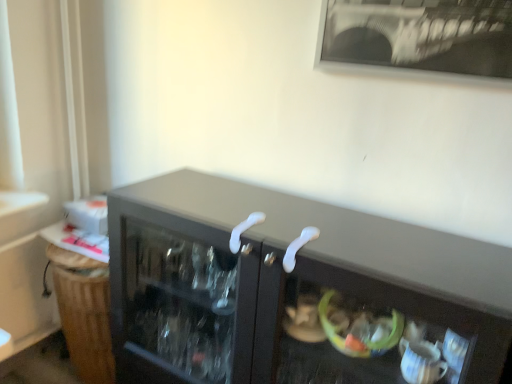
Question: Can you see white plastic door handle at center, which is counted as the 2th door handle, starting from the right, touching white plastic door handle at center, which is the 1th door handle in right-to-left order?

Choices:
 (A) no
 (B) yes

Answer: (A)

Question: From a real-world perspective, is white plastic door handle at center, the 1th door handle in the left-to-right sequence, below white plastic door handle at center, which is the 1th door handle in right-to-left order?

Choices:
 (A) yes
 (B) no

Answer: (B)

Question: Is white plastic door handle at center, which is the 1th door handle in right-to-left order, surrounded by white plastic door handle at center, the 1th door handle in the left-to-right sequence?

Choices:
 (A) no
 (B) yes

Answer: (A)

Question: Considering the relative positions of white plastic door handle at center, the 1th door handle in the left-to-right sequence, and white plastic door handle at center, which is the 1th door handle in right-to-left order, in the image provided, is white plastic door handle at center, the 1th door handle in the left-to-right sequence, to the right of white plastic door handle at center, which is the 1th door handle in right-to-left order, from the viewer's perspective?

Choices:
 (A) no
 (B) yes

Answer: (A)

Question: Does white plastic door handle at center, which is counted as the 2th door handle, starting from the right, lie behind white plastic door handle at center, which is the 1th door handle in right-to-left order?

Choices:
 (A) no
 (B) yes

Answer: (B)

Question: Does white plastic door handle at center, which is counted as the 2th door handle, starting from the right, have a smaller size compared to white plastic door handle at center, which is the 1th door handle in right-to-left order?

Choices:
 (A) yes
 (B) no

Answer: (A)

Question: Is white plastic door handle at center, which is the 1th door handle in right-to-left order, further to camera compared to white plastic door handle at center, which is counted as the 2th door handle, starting from the right?

Choices:
 (A) yes
 (B) no

Answer: (B)

Question: From a real-world perspective, is white plastic door handle at center, which is counted as the second door handle, starting from the left, beneath white plastic door handle at center, the 1th door handle in the left-to-right sequence?

Choices:
 (A) yes
 (B) no

Answer: (A)

Question: Can you confirm if white plastic door handle at center, which is counted as the second door handle, starting from the left, is shorter than white plastic door handle at center, which is counted as the 2th door handle, starting from the right?

Choices:
 (A) no
 (B) yes

Answer: (B)

Question: From the image's perspective, is white plastic door handle at center, which is the 1th door handle in right-to-left order, located beneath white plastic door handle at center, which is counted as the 2th door handle, starting from the right?

Choices:
 (A) no
 (B) yes

Answer: (B)

Question: Is white plastic door handle at center, which is the 1th door handle in right-to-left order, looking in the opposite direction of white plastic door handle at center, the 1th door handle in the left-to-right sequence?

Choices:
 (A) yes
 (B) no

Answer: (B)

Question: Is white plastic door handle at center, which is the 1th door handle in right-to-left order, beside white plastic door handle at center, the 1th door handle in the left-to-right sequence?

Choices:
 (A) yes
 (B) no

Answer: (B)

Question: Visually, is white plastic door handle at center, which is counted as the second door handle, starting from the left, positioned to the left or to the right of white plastic door handle at center, which is counted as the 2th door handle, starting from the right?

Choices:
 (A) left
 (B) right

Answer: (B)